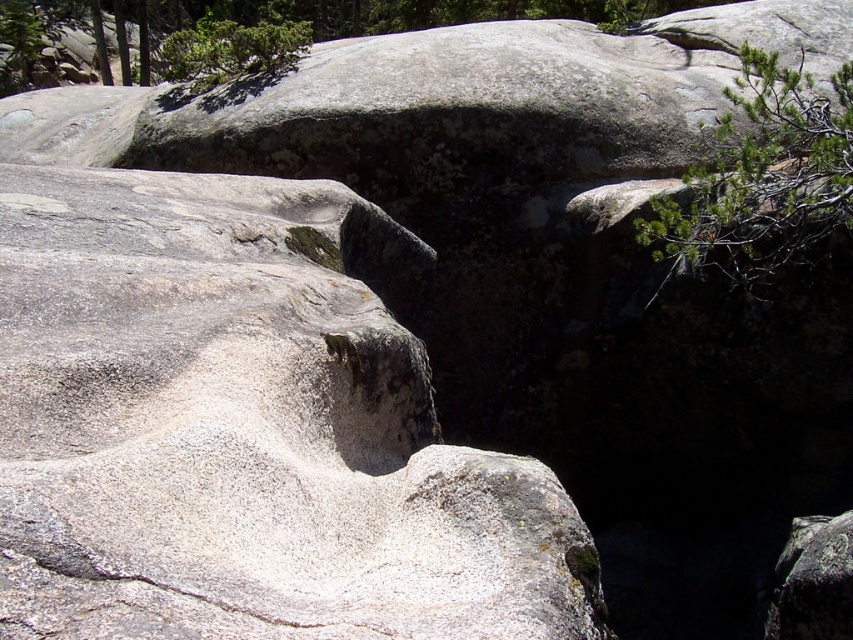
Between green needle-like plant at upper right and green leafy shrub at upper center, which one has less height?

With less height is green needle-like plant at upper right.

Between point (799, 156) and point (212, 40), which one is positioned in front?

Point (799, 156)

In order to click on green needle-like plant at upper right in this screenshot , I will do `click(763, 177)`.

This screenshot has height=640, width=853. Find the location of `green needle-like plant at upper right`. green needle-like plant at upper right is located at coordinates (763, 177).